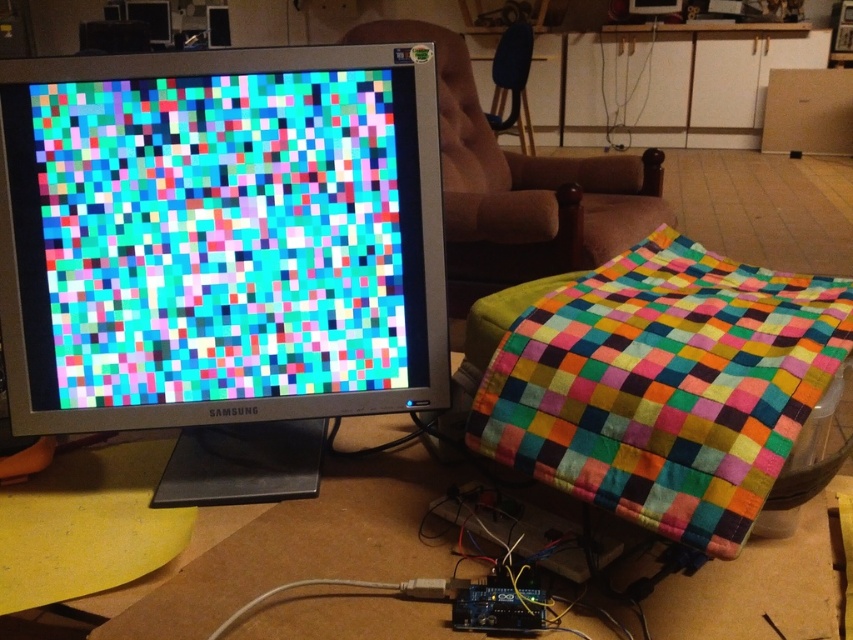
You are organizing a small electronics project and need to place both the multicolored quilt at center and the cardboard at lower left on a shelf. Which object should you place first to ensure they both fit on the shelf?

The multicolored quilt at center has a lesser width compared to cardboard at lower left, so you should place the cardboard at lower left first to accommodate its larger size before placing the multicolored quilt at center.

You are standing in front of the workspace and want to place a small electronic device between the multicolored quilt at center and the cardboard at lower left. Which object should you place it closer to in order to have it nearer to the viewer?

The multicolored quilt at center is closer to the viewer than the cardboard at lower left, so placing the device closer to the multicolored quilt at center will position it nearer to the viewer.

You are sitting in the velvet brown armchair at upper center and want to reach an item placed on the white glossy cabinet at upper center. Can you easily reach it without moving from your seat?

The white glossy cabinet at upper center is further to the viewer than the velvet brown armchair at upper center, meaning it is closer to you. Therefore, you can easily reach the item without moving from your seat.